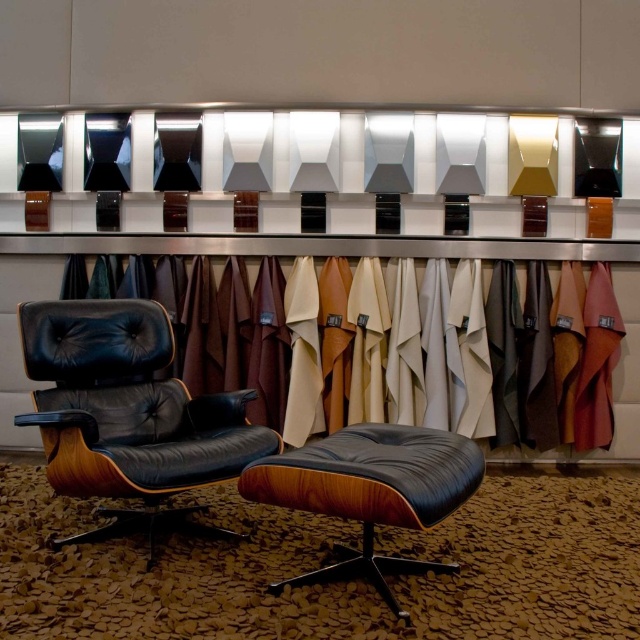
Question: Which object is positioned closest to the leather at left?

Choices:
 (A) black leather swivel chair at center
 (B) matte black leather ottoman at center

Answer: (A)

Question: Is leather at left smaller than matte black leather ottoman at center?

Choices:
 (A) no
 (B) yes

Answer: (A)

Question: Which is nearer to the leather at left?

Choices:
 (A) black leather swivel chair at center
 (B) matte black leather ottoman at center

Answer: (A)

Question: Can you confirm if black leather swivel chair at center is thinner than leather at left?

Choices:
 (A) yes
 (B) no

Answer: (A)

Question: Which is nearer to the leather at left?

Choices:
 (A) black leather swivel chair at center
 (B) matte black leather ottoman at center

Answer: (A)

Question: Does leather at left have a smaller size compared to matte black leather ottoman at center?

Choices:
 (A) yes
 (B) no

Answer: (B)